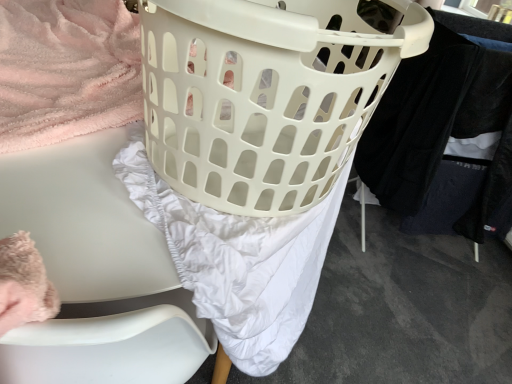
The image size is (512, 384). Identify the location of white plastic laundry basket at center. (264, 95).

From the image's perspective, is white plastic laundry basket at center above black cotton pants at right?

No, from the image's perspective, white plastic laundry basket at center is not over black cotton pants at right.

What's the angular difference between white plastic laundry basket at center and black cotton pants at right's facing directions?

The angle between the facing direction of white plastic laundry basket at center and the facing direction of black cotton pants at right is 2.55 degrees.

Is white plastic laundry basket at center inside or outside of black cotton pants at right?

white plastic laundry basket at center exists outside the volume of black cotton pants at right.

Which object is wider, black cotton pants at right or white plastic chair at left?

Wider between the two is black cotton pants at right.

Locate an element on the screen. The height and width of the screenshot is (384, 512). furniture in front of the black cotton pants at right is located at coordinates (96, 274).

Considering the relative positions of black cotton pants at right and white plastic chair at left in the image provided, is black cotton pants at right to the left or to the right of white plastic chair at left?

From the image, it's evident that black cotton pants at right is to the right of white plastic chair at left.

From their relative heights in the image, would you say black cotton pants at right is taller or shorter than white plastic chair at left?

In the image, black cotton pants at right appears to be taller than white plastic chair at left.

Between black cotton pants at right and white plastic laundry basket at center, which one is positioned behind?

black cotton pants at right is more distant.

Which is correct: black cotton pants at right is inside white plastic laundry basket at center, or outside of it?

black cotton pants at right is spatially situated outside white plastic laundry basket at center.

Is point (465, 124) closer to camera compared to point (340, 134)?

No, it is not.

Is black cotton pants at right not close to white plastic laundry basket at center?

They are positioned close to each other.

Can you confirm if white plastic chair at left is shorter than black cotton pants at right?

Correct, white plastic chair at left is not as tall as black cotton pants at right.

From the image's perspective, is white plastic chair at left under black cotton pants at right?

Yes, from the image's perspective, white plastic chair at left is beneath black cotton pants at right.

From the image's perspective, is white plastic chair at left on white plastic laundry basket at center?

No, from the image's perspective, white plastic chair at left is not on top of white plastic laundry basket at center.

Can you confirm if white plastic chair at left is wider than white plastic laundry basket at center?

No.

Is white plastic chair at left surrounding white plastic laundry basket at center?

No, white plastic chair at left does not contain white plastic laundry basket at center.

Does white plastic chair at left appear on the left side of white plastic laundry basket at center?

Yes.

Is white plastic laundry basket at center facing away from white plastic chair at left?

No.

Does white plastic laundry basket at center have a smaller size compared to white plastic chair at left?

Indeed, white plastic laundry basket at center has a smaller size compared to white plastic chair at left.

Looking at this image, how much distance is there between white plastic laundry basket at center and white plastic chair at left?

10.84 inches.

Is white plastic laundry basket at center inside or outside of white plastic chair at left?

white plastic laundry basket at center is spatially situated outside white plastic chair at left.

Where is `basket in front of the black cotton pants at right`? Image resolution: width=512 pixels, height=384 pixels. basket in front of the black cotton pants at right is located at coordinates (264, 95).

At what (x,y) coordinates should I click in order to perform the action: click on furniture that appears below the black cotton pants at right (from a real-world perspective). Please return your answer as a coordinate pair (x, y). This screenshot has width=512, height=384. Looking at the image, I should click on (96, 274).

Which object lies nearer to the anchor point white plastic chair at left, white plastic laundry basket at center or black cotton pants at right?

white plastic laundry basket at center is positioned closer to the anchor white plastic chair at left.

Which object lies nearer to the anchor point white plastic laundry basket at center, white plastic chair at left or black cotton pants at right?

Among the two, white plastic chair at left is located nearer to white plastic laundry basket at center.

When comparing their distances from black cotton pants at right, does white plastic chair at left or white plastic laundry basket at center seem closer?

A: Based on the image, white plastic laundry basket at center appears to be nearer to black cotton pants at right.

Looking at the image, which one is located closer to black cotton pants at right, white plastic laundry basket at center or white plastic chair at left?

The object closer to black cotton pants at right is white plastic laundry basket at center.

From the image, which object appears to be farther from white plastic laundry basket at center, black cotton pants at right or white plastic chair at left?

Among the two, black cotton pants at right is located further to white plastic laundry basket at center.

Looking at this image, when comparing their distances from white plastic chair at left, does black cotton pants at right or white plastic laundry basket at center seem further?

Among the two, black cotton pants at right is located further to white plastic chair at left.

Where is `basket located between white plastic chair at left and black cotton pants at right in the left-right direction`? The image size is (512, 384). basket located between white plastic chair at left and black cotton pants at right in the left-right direction is located at coordinates (264, 95).